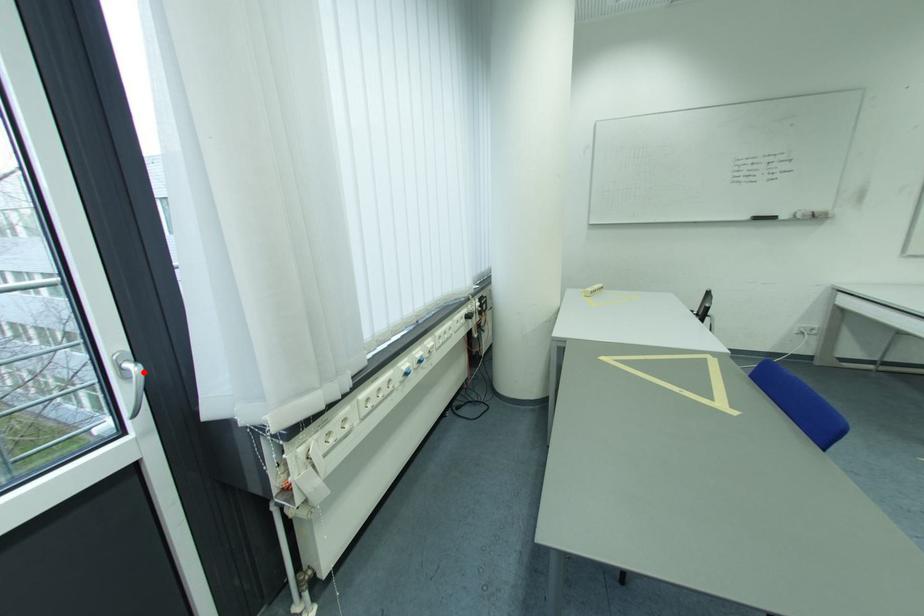
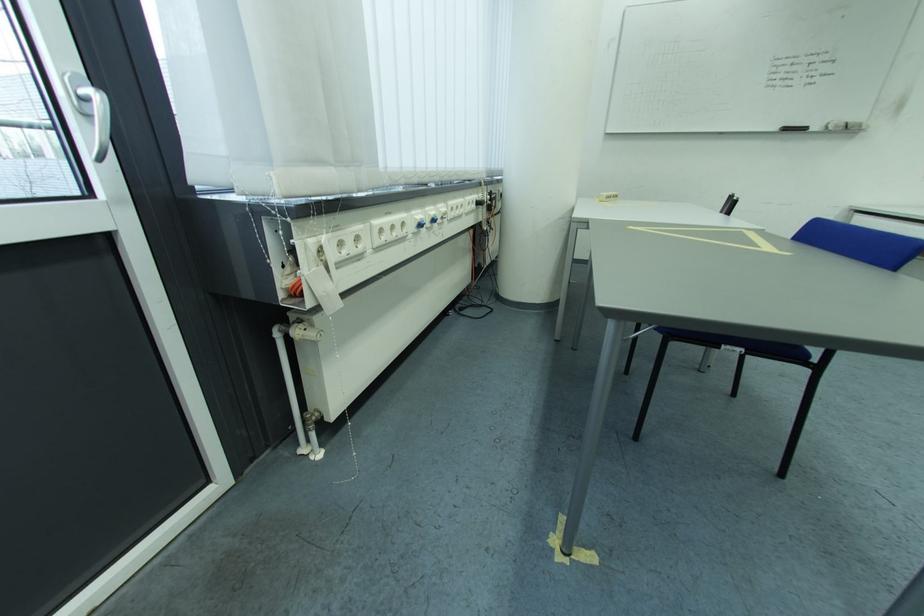
The point at the highlighted location is marked in the first image. Where is the corresponding point in the second image?

(106, 98)